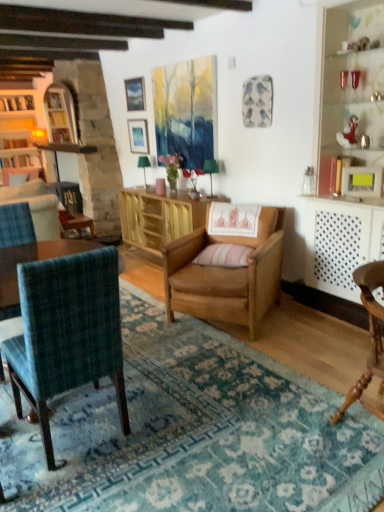
What is the approximate width of green fabric lampshade at center, marked as the 2th lamp in a left-to-right arrangement?

It is 6.60 inches.

What do you see at coordinates (135, 94) in the screenshot? The width and height of the screenshot is (384, 512). I see `matte wooden picture frame at upper center, the 1th picture frame positioned from the top` at bounding box center [135, 94].

What do you see at coordinates (227, 265) in the screenshot?
I see `light brown wood chair at center, which ranks as the 2th chair in right-to-left order` at bounding box center [227, 265].

Locate an element on the screen. This screenshot has width=384, height=512. matte silver picture frame at upper center, marked as the 2th picture frame in a right-to-left arrangement is located at coordinates (138, 136).

Identify the location of matte white picture frame at upper right, which is the third picture frame from top to bottom. This screenshot has width=384, height=512. (362, 181).

What do you see at coordinates (60, 115) in the screenshot? I see `wooden bookshelf at left` at bounding box center [60, 115].

You are a GUI agent. You are given a task and a screenshot of the screen. Output one action in this format:
    pyautogui.click(x=<x>, y=<y>)
    Task: Click on the green fabric lampshade at center, placed as the 1th lamp when sorted from front to back
    
    Given the screenshot: What is the action you would take?
    pyautogui.click(x=211, y=172)

From the image's perspective, is matte silver picture frame at upper center, marked as the 2th picture frame in a right-to-left arrangement, above or below teal plaid chair at left, which ranks as the 3th chair in right-to-left order?

Based on their image positions, matte silver picture frame at upper center, marked as the 2th picture frame in a right-to-left arrangement, is located above teal plaid chair at left, which ranks as the 3th chair in right-to-left order.

Does matte silver picture frame at upper center, arranged as the 2th picture frame when ordered from the bottom, turn towards teal plaid chair at left, marked as the first chair in a left-to-right arrangement?

No, matte silver picture frame at upper center, arranged as the 2th picture frame when ordered from the bottom, does not turn towards teal plaid chair at left, marked as the first chair in a left-to-right arrangement.

Which of these two, matte silver picture frame at upper center, the third picture frame when ordered from front to back, or teal plaid chair at left, which ranks as the 3th chair in right-to-left order, stands taller?

teal plaid chair at left, which ranks as the 3th chair in right-to-left order, is taller.

Considering the sizes of objects matte silver picture frame at upper center, the third picture frame when ordered from front to back, and teal plaid chair at left, which ranks as the 3th chair in right-to-left order, in the image provided, who is bigger, matte silver picture frame at upper center, the third picture frame when ordered from front to back, or teal plaid chair at left, which ranks as the 3th chair in right-to-left order,?

With larger size is teal plaid chair at left, which ranks as the 3th chair in right-to-left order.

Which of these two, light brown wood chair at center, which ranks as the 2th chair in right-to-left order, or green fabric lampshade at center, placed as the 1th lamp when sorted from front to back, is thinner?

With smaller width is green fabric lampshade at center, placed as the 1th lamp when sorted from front to back.

From the image's perspective, which is below, light brown wood chair at center, acting as the second chair starting from the left, or green fabric lampshade at center, which appears as the 2th lamp when viewed from the back?

light brown wood chair at center, acting as the second chair starting from the left, from the image's perspective.

From the image's perspective, count 1st lamps upward from the light brown wood chair at center, acting as the second chair starting from the left, and point to it. Please provide its 2D coordinates.

[(211, 172)]

Considering the sizes of objects green fabric lampshade at center, placed as the 1th lamp when sorted from front to back, and wooden bookshelf at left in the image provided, who is shorter, green fabric lampshade at center, placed as the 1th lamp when sorted from front to back, or wooden bookshelf at left?

Standing shorter between the two is green fabric lampshade at center, placed as the 1th lamp when sorted from front to back.

From a real-world perspective, who is located lower, green fabric lampshade at center, the first lamp in the right-to-left sequence, or wooden bookshelf at left?

green fabric lampshade at center, the first lamp in the right-to-left sequence, from a real-world perspective.

Does green fabric lampshade at center, which appears as the 2th lamp when viewed from the back, turn towards wooden bookshelf at left?

No, green fabric lampshade at center, which appears as the 2th lamp when viewed from the back, does not turn towards wooden bookshelf at left.

Consider the image. Is teal plaid chair at left, which ranks as the 3th chair in right-to-left order, in front of or behind wooden bookshelf at left in the image?

In the image, teal plaid chair at left, which ranks as the 3th chair in right-to-left order, appears in front of wooden bookshelf at left.

In the scene shown: Measure the distance between teal plaid chair at left, which ranks as the 3th chair in right-to-left order, and wooden bookshelf at left.

4.60 meters.

From the image's perspective, is teal plaid chair at left, which ranks as the 3th chair in right-to-left order, positioned above or below wooden bookshelf at left?

Clearly, from the image's perspective, teal plaid chair at left, which ranks as the 3th chair in right-to-left order, is below wooden bookshelf at left.

Is teal plaid chair at left, which ranks as the 3th chair in right-to-left order, thinner than wooden bookshelf at left?

No, teal plaid chair at left, which ranks as the 3th chair in right-to-left order, is not thinner than wooden bookshelf at left.

Is point (129, 94) closer or farther from the camera than point (143, 134)?

Point (129, 94) is farther from the camera than point (143, 134).

In terms of height, does matte wooden picture frame at upper center, the second picture frame viewed from the back, look taller or shorter compared to matte silver picture frame at upper center, which is counted as the second picture frame, starting from the left?

Considering their sizes, matte wooden picture frame at upper center, the second picture frame viewed from the back, has less height than matte silver picture frame at upper center, which is counted as the second picture frame, starting from the left.

At what (x,y) coordinates should I click in order to perform the action: click on the 1st picture frame below the matte wooden picture frame at upper center, the 3th picture frame from the bottom (from the image's perspective). Please return your answer as a coordinate pair (x, y). The height and width of the screenshot is (512, 384). Looking at the image, I should click on (138, 136).

Is matte wooden picture frame at upper center, the second picture frame viewed from the back, closer to camera compared to matte silver picture frame at upper center, marked as the 2th picture frame in a right-to-left arrangement?

Yes, it is.

Between white polka dot radiator at right and wooden chair at lower right, which is counted as the first chair, starting from the right, which one has smaller width?

white polka dot radiator at right is thinner.

From a real-world perspective, is white polka dot radiator at right below wooden chair at lower right, marked as the third chair in a left-to-right arrangement?

No, from a real-world perspective, white polka dot radiator at right is not beneath wooden chair at lower right, marked as the third chair in a left-to-right arrangement.

Which object is positioned more to the left, white polka dot radiator at right or wooden chair at lower right, marked as the third chair in a left-to-right arrangement?

wooden chair at lower right, marked as the third chair in a left-to-right arrangement, is more to the left.

Which object is further away from the camera, white polka dot radiator at right or wooden chair at lower right, marked as the third chair in a left-to-right arrangement?

Positioned behind is white polka dot radiator at right.

Can you tell me how much teal plaid chair at left, which ranks as the 3th chair in right-to-left order, and green fabric lampshade at center, placed as the 1th lamp when sorted from front to back, differ in facing direction?

The angle between the facing direction of teal plaid chair at left, which ranks as the 3th chair in right-to-left order, and the facing direction of green fabric lampshade at center, placed as the 1th lamp when sorted from front to back, is 91.6 degrees.

From their relative heights in the image, would you say teal plaid chair at left, which ranks as the 3th chair in right-to-left order, is taller or shorter than green fabric lampshade at center, marked as the 2th lamp in a left-to-right arrangement?

In the image, teal plaid chair at left, which ranks as the 3th chair in right-to-left order, appears to be taller than green fabric lampshade at center, marked as the 2th lamp in a left-to-right arrangement.

From the image's perspective, count 1st lamps upward from the teal plaid chair at left, which ranks as the 3th chair in right-to-left order, and point to it. Please provide its 2D coordinates.

[(211, 172)]

Consider the image. Is teal plaid chair at left, marked as the first chair in a left-to-right arrangement, smaller than green fabric lampshade at center, marked as the 2th lamp in a left-to-right arrangement?

No.

From the teal plaid chair at left, which ranks as the 3th chair in right-to-left order, count the 1st picture frame to the left and point to it. Please provide its 2D coordinates.

[(138, 136)]

From the light brown wood chair at center, acting as the second chair starting from the left, count 1st lamps backward and point to it. Please provide its 2D coordinates.

[(211, 172)]

Considering their positions, is matte white picture frame at upper right, the third picture frame positioned from the left, positioned closer to wooden bookshelf at left than pink striped pillow at center?

pink striped pillow at center lies closer to wooden bookshelf at left than the other object.

Estimate the real-world distances between objects in this image. Which object is closer to green fabric lampshade at center, marked as the 2th lamp in a left-to-right arrangement, matte wooden picture frame at upper center, the 3th picture frame from the bottom, or wooden cabinet at center?

wooden cabinet at center is closer to green fabric lampshade at center, marked as the 2th lamp in a left-to-right arrangement.

Looking at the image, which one is located further to white polka dot radiator at right, teal plaid chair at left, marked as the first chair in a left-to-right arrangement, or wooden bookshelf at left?

Among the two, wooden bookshelf at left is located further to white polka dot radiator at right.

Based on their spatial positions, is green fabric lampshade at upper center, which is counted as the 1th lamp, starting from the left, or wooden chair at lower right, which is counted as the first chair, starting from the right, closer to wooden cabinet at center?

green fabric lampshade at upper center, which is counted as the 1th lamp, starting from the left, is closer to wooden cabinet at center.

Which object lies nearer to the anchor point white polka dot radiator at right, light brown wood chair at center, acting as the second chair starting from the left, or wooden cabinet at center?

light brown wood chair at center, acting as the second chair starting from the left.

Estimate the real-world distances between objects in this image. Which object is further from matte white picture frame at upper right, the 1th picture frame when ordered from front to back, wooden chair at lower right, marked as the third chair in a left-to-right arrangement, or green fabric lampshade at upper center, which is counted as the first lamp, starting from the back?

green fabric lampshade at upper center, which is counted as the first lamp, starting from the back, is further to matte white picture frame at upper right, the 1th picture frame when ordered from front to back.

When comparing their distances from matte white picture frame at upper right, the 1th picture frame when ordered from front to back, does white polka dot radiator at right or teal plaid chair at left, which ranks as the 3th chair in right-to-left order, seem further?

Based on the image, teal plaid chair at left, which ranks as the 3th chair in right-to-left order, appears to be further to matte white picture frame at upper right, the 1th picture frame when ordered from front to back.

Considering their positions, is matte pink cup at center positioned further to pink striped pillow at center than wooden cabinet at center?

matte pink cup at center is positioned further to the anchor pink striped pillow at center.

Find the location of `dresser positioned between teal plaid chair at left, which ranks as the 3th chair in right-to-left order, and wooden bookshelf at left from near to far`. dresser positioned between teal plaid chair at left, which ranks as the 3th chair in right-to-left order, and wooden bookshelf at left from near to far is located at coordinates (347, 147).

What are the coordinates of `lamp between matte wooden picture frame at upper center, the second picture frame viewed from the back, and green fabric lampshade at center, marked as the 2th lamp in a left-to-right arrangement, from top to bottom` in the screenshot? It's located at (144, 166).

Find the location of a particular element. The width and height of the screenshot is (384, 512). picture frame located between wooden bookshelf at left and matte silver picture frame at upper center, the third picture frame when ordered from front to back, in the left-right direction is located at coordinates (135, 94).

This screenshot has height=512, width=384. Identify the location of table positioned between white polka dot radiator at right and matte wooden picture frame at upper center, the 1th picture frame positioned from the top, from near to far. (158, 218).